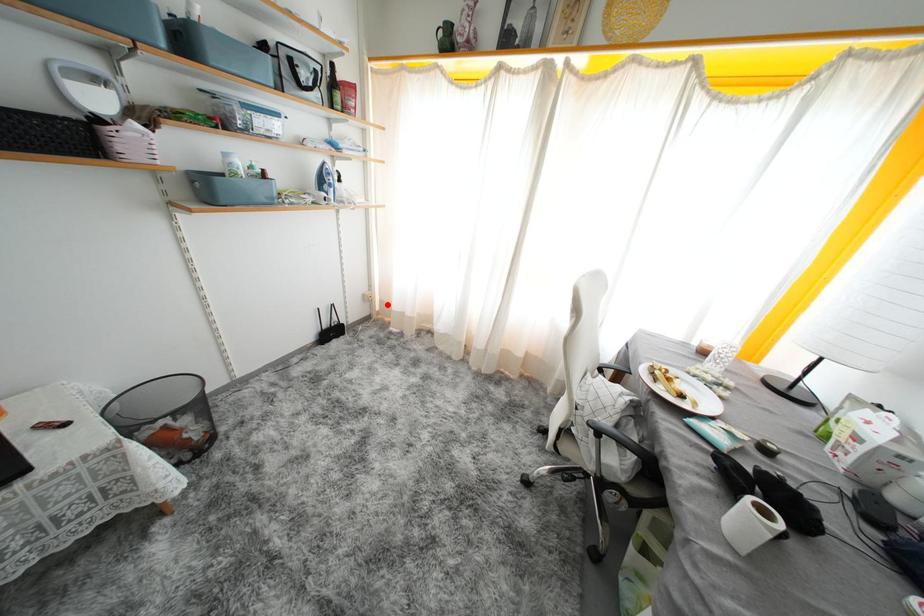
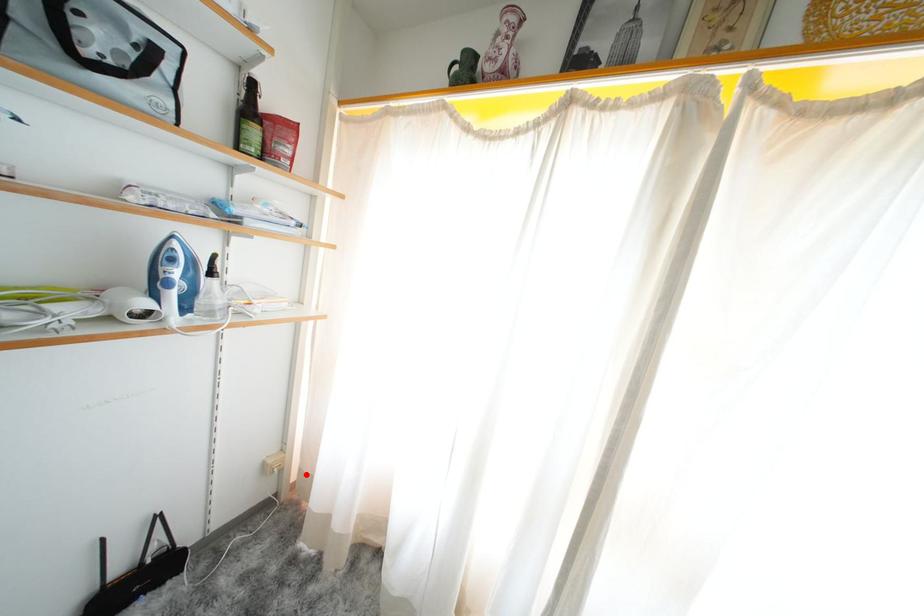
I am providing you with two images of the same scene from different viewpoints. A red point is marked on the first image and another point is marked on the second image. Is the red point in image1 aligned with the point shown in image2?

Yes